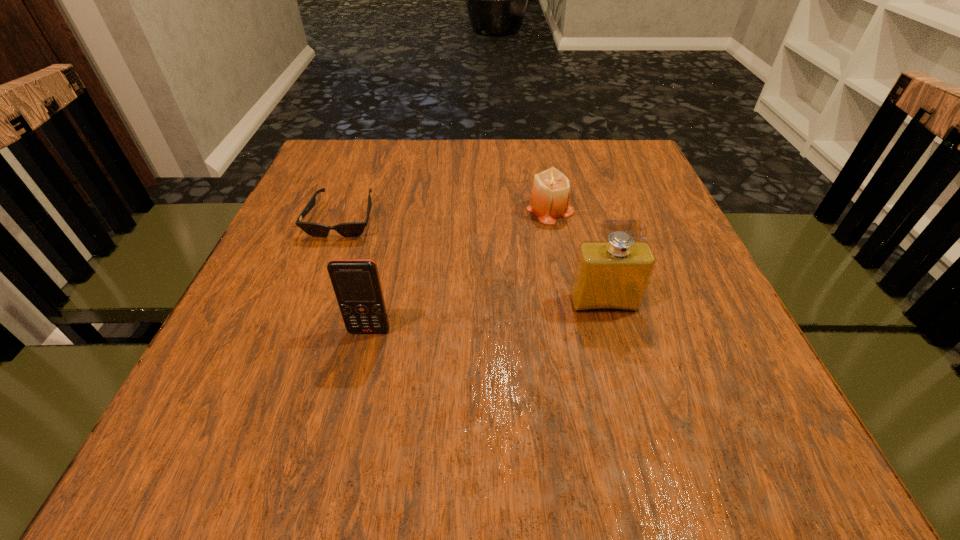
Locate an element on the screen. This screenshot has width=960, height=540. free area in between the perfume and the candle is located at coordinates (577, 256).

The image size is (960, 540). I want to click on empty space that is in between the cellular telephone and the perfume, so click(487, 317).

Locate an element on the screen. Image resolution: width=960 pixels, height=540 pixels. empty location between the leftmost object and the perfume is located at coordinates (473, 261).

This screenshot has width=960, height=540. Identify the location of empty space that is in between the cellular telephone and the perfume. (487, 317).

Identify the location of free point between the second shortest object and the third farthest object. The image size is (960, 540). (577, 256).

The height and width of the screenshot is (540, 960). In order to click on vacant space that's between the leftmost object and the candle in this screenshot , I will do `click(446, 214)`.

I want to click on vacant area between the perfume and the candle, so click(x=577, y=256).

At what (x,y) coordinates should I click in order to perform the action: click on object that can be found as the third closest to the second shortest object. Please return your answer as a coordinate pair (x, y). This screenshot has width=960, height=540. Looking at the image, I should click on (356, 282).

Point out which object is positioned as the nearest to the shortest object. Please provide its 2D coordinates. Your answer should be formatted as a tuple, i.e. [(x, y)], where the tuple contains the x and y coordinates of a point satisfying the conditions above.

[(356, 282)]